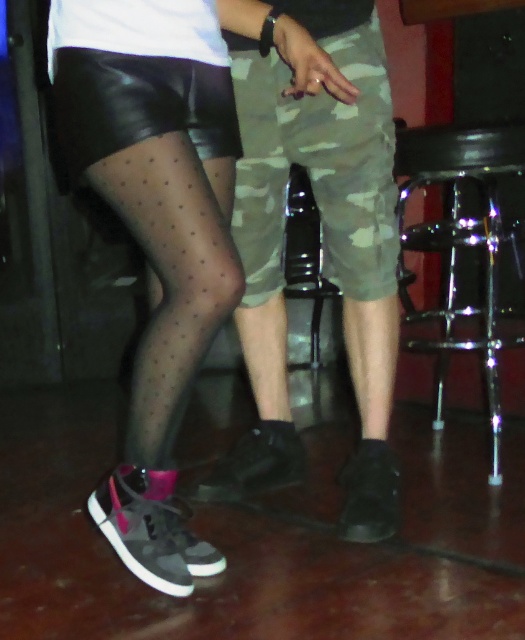
Question: Can you confirm if camo fabric shorts at center is wider than camouflage fabric shorts at center?

Choices:
 (A) no
 (B) yes

Answer: (B)

Question: Based on their relative distances, which object is farther from the shiny chrome bar stool at right?

Choices:
 (A) camo fabric shorts at center
 (B) camouflage fabric shorts at center

Answer: (A)

Question: Which point is closer to the camera?

Choices:
 (A) shiny chrome bar stool at right
 (B) camouflage fabric shorts at center

Answer: (B)

Question: Estimate the real-world distances between objects in this image. Which object is farther from the camo fabric shorts at center?

Choices:
 (A) camouflage fabric shorts at center
 (B) shiny chrome bar stool at right

Answer: (B)

Question: Does camo fabric shorts at center lie in front of shiny chrome bar stool at right?

Choices:
 (A) yes
 (B) no

Answer: (A)

Question: Can you confirm if camo fabric shorts at center is smaller than camouflage fabric shorts at center?

Choices:
 (A) yes
 (B) no

Answer: (B)